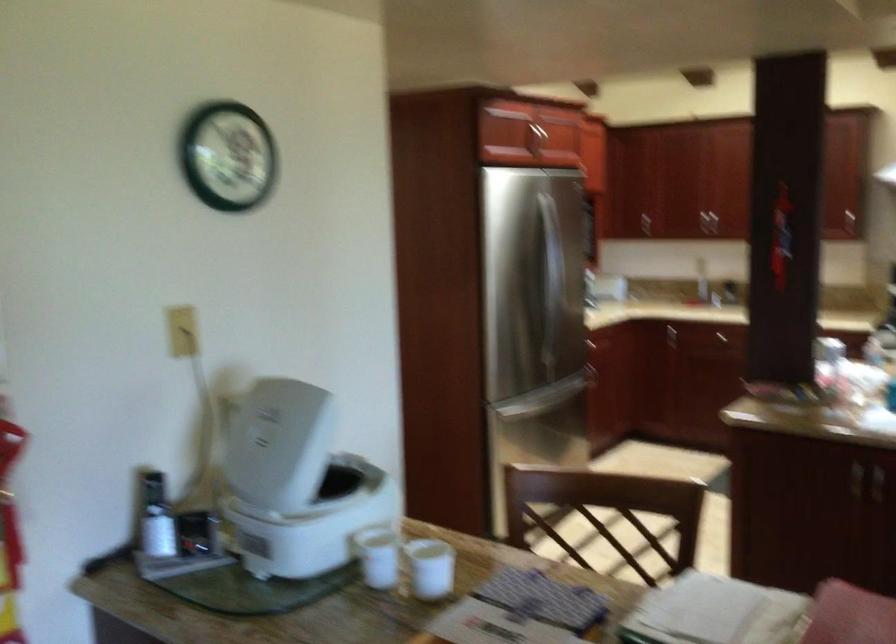
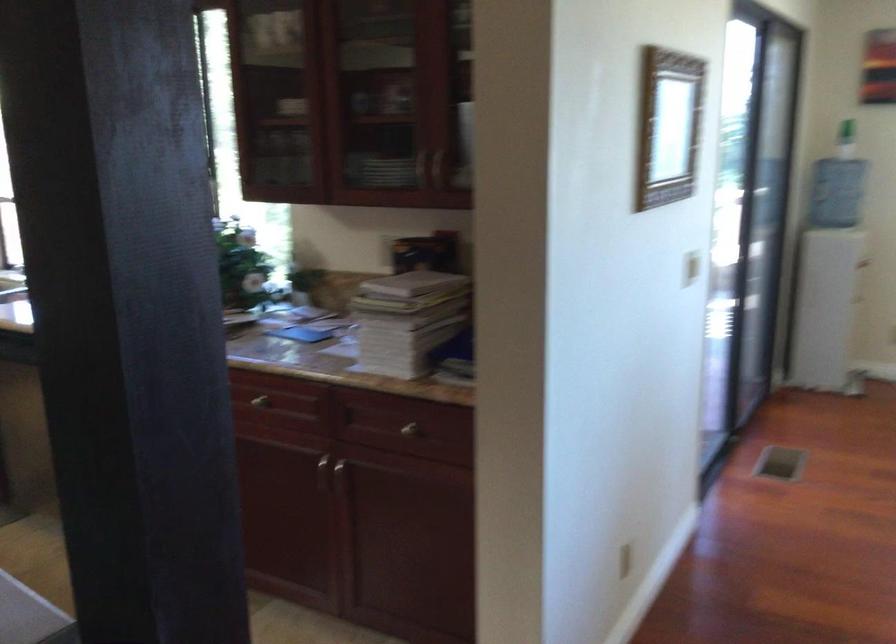
Question: The camera is either moving clockwise (left) or counter-clockwise (right) around the object. The first image is from the beginning of the video and the second image is from the end. Is the camera moving left or right when shooting the video?

Choices:
 (A) Left
 (B) Right

Answer: (A)